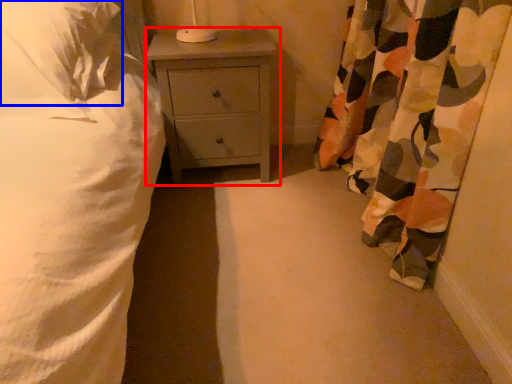
Question: Which of the following is the closest to the observer, nightstand (highlighted by a red box) or pillow (highlighted by a blue box)?

Choices:
 (A) nightstand
 (B) pillow

Answer: (B)